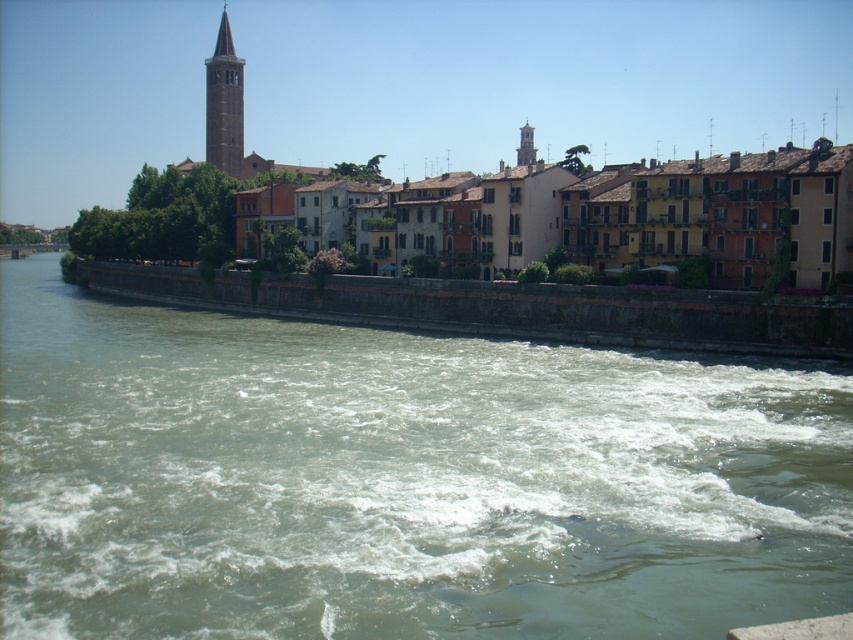
In the scene shown: You are standing at the edge of the river and want to take a photo of the multicolored stone buildings at center. Given their position relative to your current location, in which direction should you point your camera to capture them?

The multicolored stone buildings at center are located at point coordinates approximately 0.339 along the x axis and 0.708 along the y axis. Since you are at the edge of the river, which is in the foreground, you would need to aim your camera towards the middle ground where the buildings are situated. Specifically, looking towards the central area of the image, slightly to the right if the x coordinate is measured from the left, as 0.339 suggests a position one third from the left edge. The y coordinate of

You are a tourist standing on the stone embankment and want to take a photo of both the greenish concrete river at center and the smooth beige bell tower at upper left. Which object should you focus on first to ensure both are in frame?

The greenish concrete river at center is smaller than the smooth beige bell tower at upper left, so you should focus on the smooth beige bell tower at upper left first to ensure both are in frame since it takes up more space in the image.

You are a tourist standing on the riverside embankment and want to take a photo of both the multicolored stone buildings at center and the smooth beige bell tower at upper left. Based on their positions, which one should you point your camera towards first to capture both in the frame?

The multicolored stone buildings at center is below the smooth beige bell tower at upper left, so you should point your camera towards the smooth beige bell tower at upper left first to ensure both are in the frame.